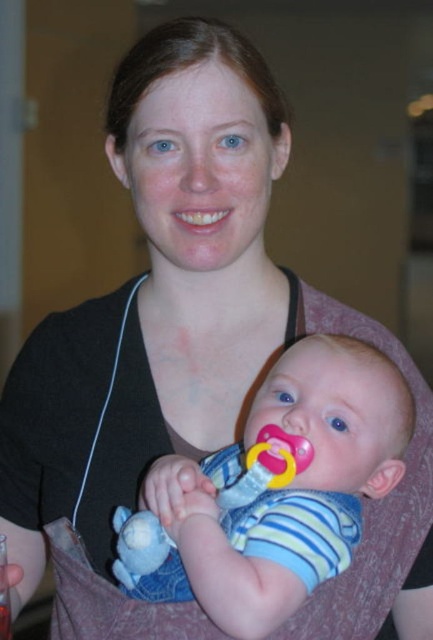
Does striped fabric baby at center have a lesser height compared to pink rubber pacifier at center?

Answer: In fact, striped fabric baby at center may be taller than pink rubber pacifier at center.

Is point (351, 465) more distant than point (226, 483)?

That is False.

In order to click on striped fabric baby at center in this screenshot , I will do `click(283, 490)`.